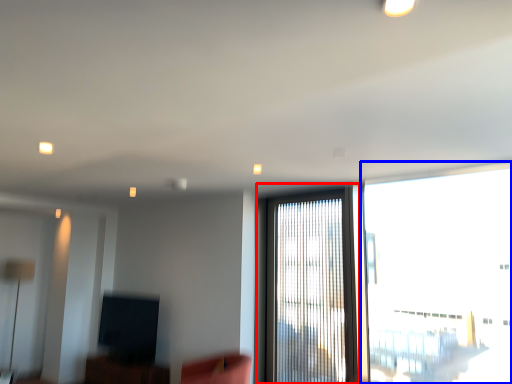
Question: Which point is further to the camera, window (highlighted by a red box) or window (highlighted by a blue box)?

Choices:
 (A) window
 (B) window

Answer: (A)